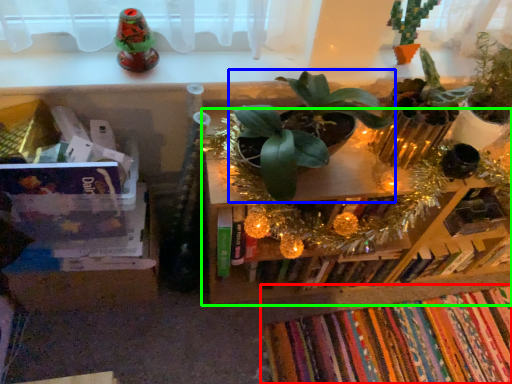
Question: Which is nearer to the book (highlighted by a red box)? houseplant (highlighted by a blue box) or shelf (highlighted by a green box).

Choices:
 (A) houseplant
 (B) shelf

Answer: (B)